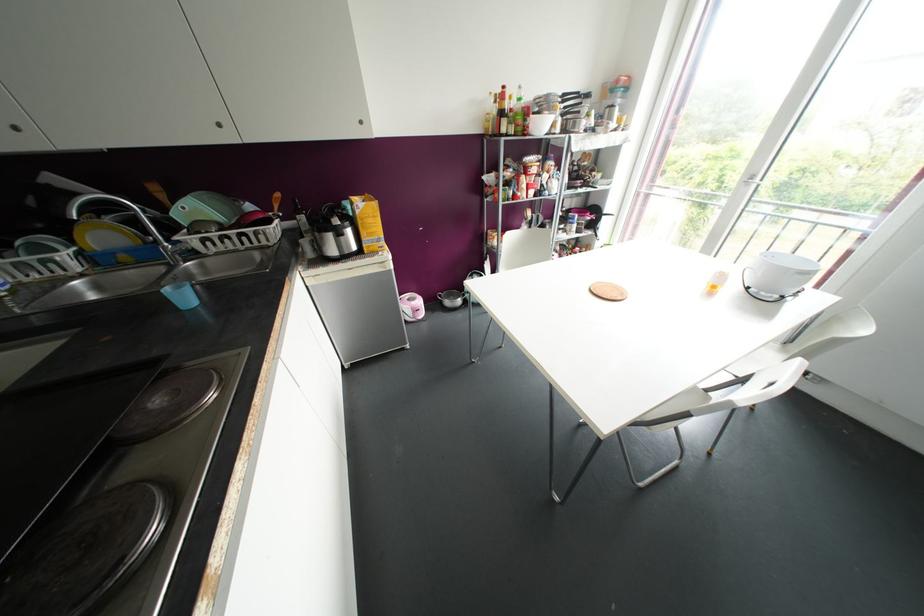
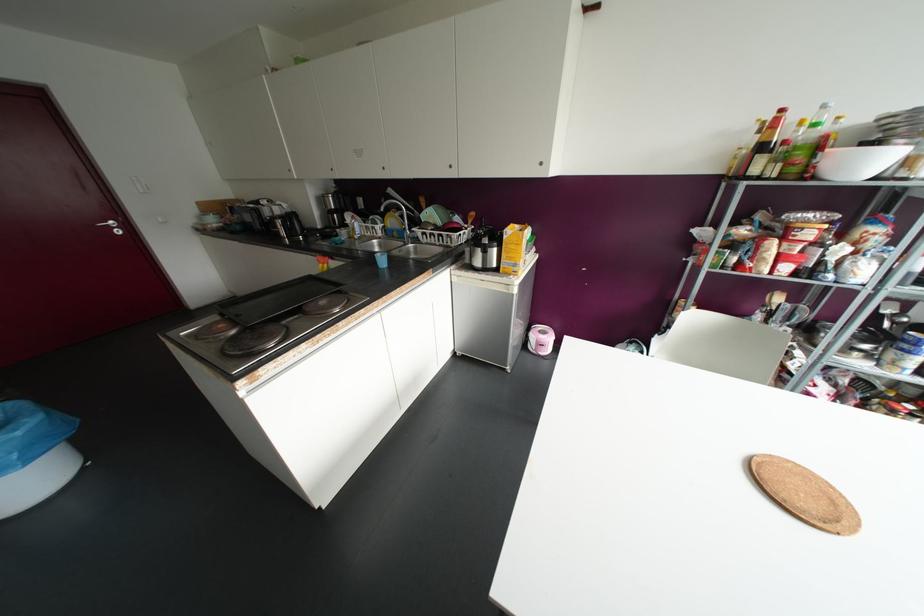
Locate, in the second image, the point that corresponds to (x=518, y=86) in the first image.

(823, 106)